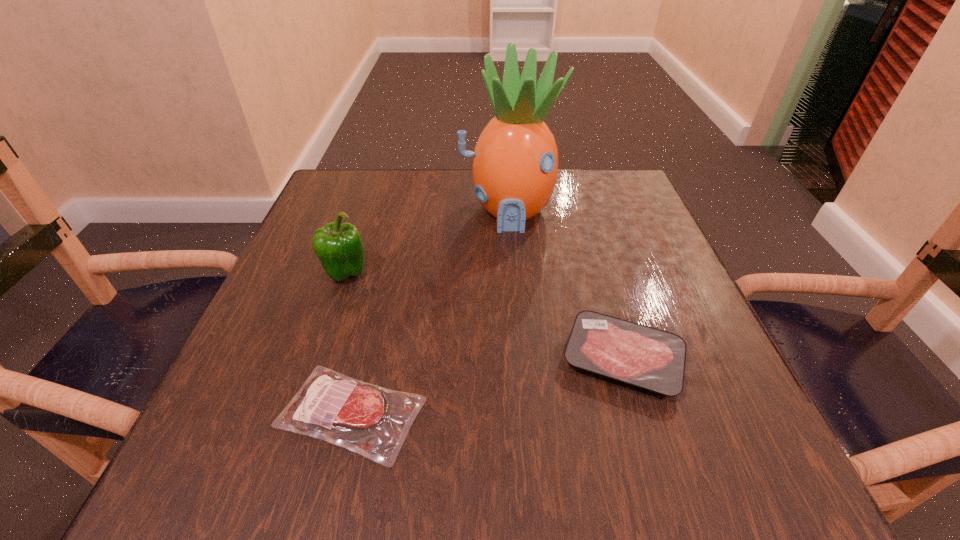
Find the location of a particular element. Image resolution: width=960 pixels, height=540 pixels. vacant point located between the pineapple and the left steak is located at coordinates (429, 312).

Find the location of `unoccupied position between the left steak and the right steak`. unoccupied position between the left steak and the right steak is located at coordinates (487, 386).

Choose which object is the third nearest neighbor to the left steak. Please provide its 2D coordinates. Your answer should be formatted as a tuple, i.e. [(x, y)], where the tuple contains the x and y coordinates of a point satisfying the conditions above.

[(514, 168)]

Locate which object ranks third in proximity to the right steak. Please provide its 2D coordinates. Your answer should be formatted as a tuple, i.e. [(x, y)], where the tuple contains the x and y coordinates of a point satisfying the conditions above.

[(339, 247)]

Where is `vacant space that satisfies the following two spatial constraints: 1. at the entrance of the tallest object; 2. on the right side of the right steak`? vacant space that satisfies the following two spatial constraints: 1. at the entrance of the tallest object; 2. on the right side of the right steak is located at coordinates tap(520, 359).

This screenshot has width=960, height=540. In order to click on free region that satisfies the following two spatial constraints: 1. on the front side of the second tallest object; 2. on the left side of the left steak in this screenshot , I will do `click(300, 413)`.

Find the location of `free space that satisfies the following two spatial constraints: 1. at the entrance of the farthest object; 2. on the left side of the right steak`. free space that satisfies the following two spatial constraints: 1. at the entrance of the farthest object; 2. on the left side of the right steak is located at coordinates point(520,359).